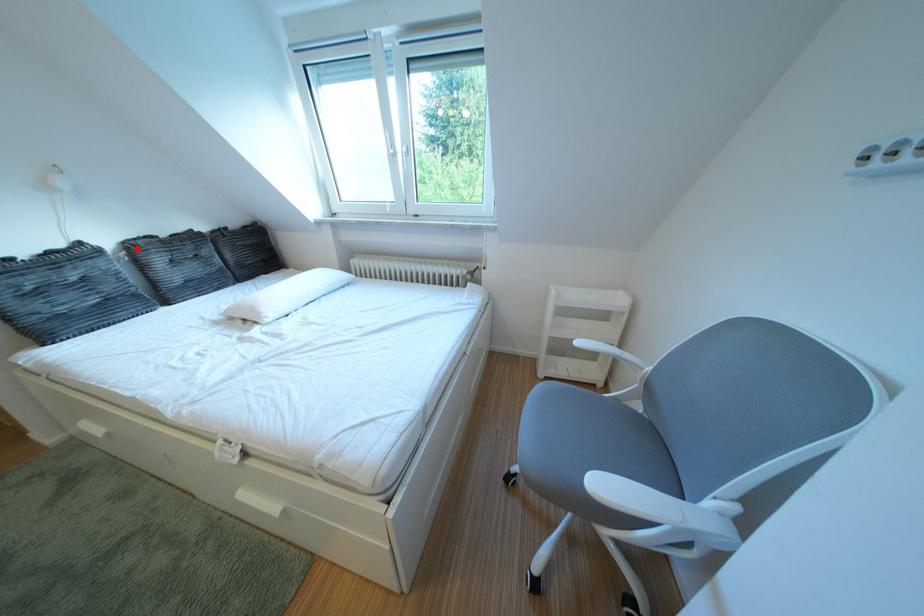
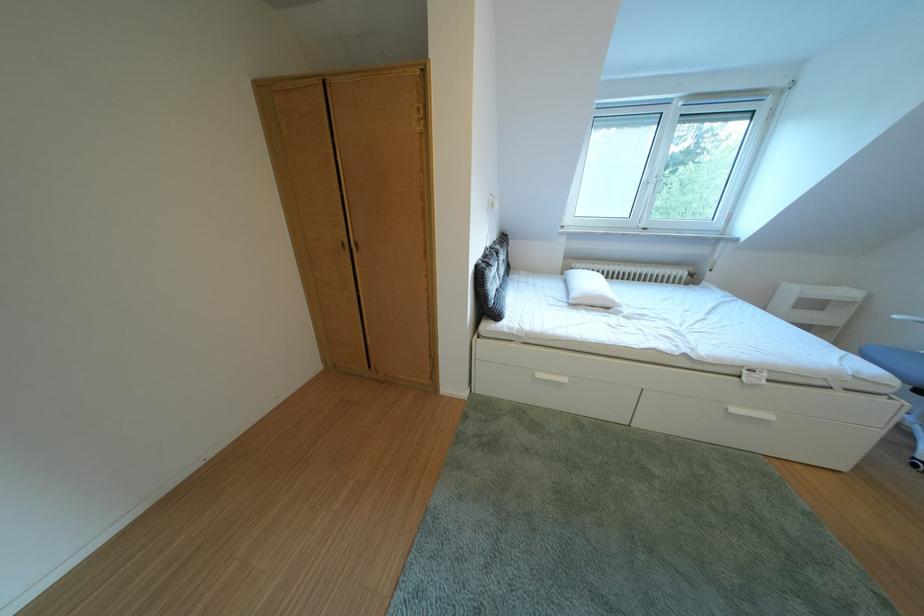
Question: I am providing you with two images of the same scene from different viewpoints. A red point is marked on the first image. Can you still see the location of the red point in image 2?

Choices:
 (A) Yes
 (B) No

Answer: (A)